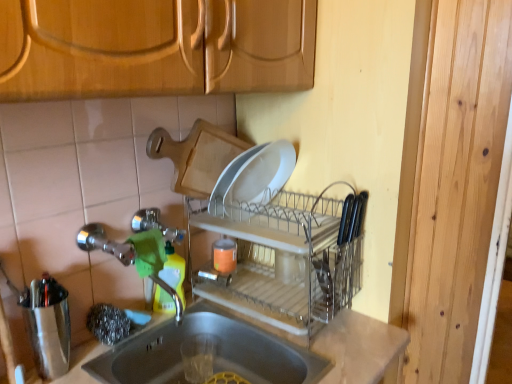
This screenshot has height=384, width=512. Identify the location of free space to the right of green plastic bottle at sink. (227, 316).